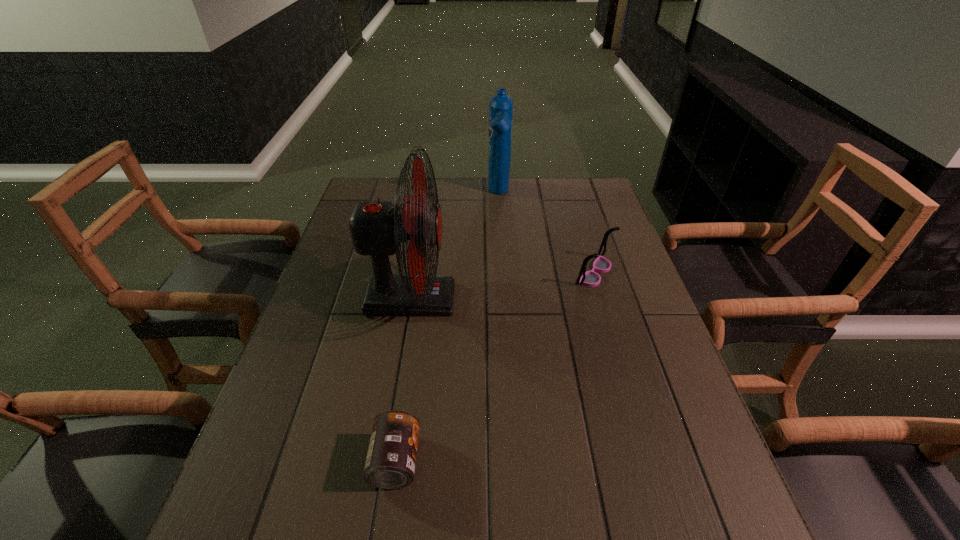
I want to click on vacant space situated 0.330m on the front label of the shortest object, so click(591, 461).

At what (x,y) coordinates should I click in order to perform the action: click on object that is positioned at the far edge. Please return your answer as a coordinate pair (x, y). This screenshot has width=960, height=540. Looking at the image, I should click on (500, 105).

Find the location of a particular element. The image size is (960, 540). object present at the left edge is located at coordinates (377, 228).

Where is `object at the right edge`? This screenshot has width=960, height=540. object at the right edge is located at coordinates (590, 278).

Find the location of a particular element. vacant space at the far edge of the desktop is located at coordinates [530, 197].

In order to click on free point at the left edge in this screenshot , I will do `click(289, 484)`.

In the image, there is a desktop. Where is `vacant space at the right edge`? vacant space at the right edge is located at coordinates (696, 483).

Find the location of a particular element. The width and height of the screenshot is (960, 540). vacant space at the far left corner of the desktop is located at coordinates (380, 183).

At what (x,y) coordinates should I click in order to perform the action: click on vacant space at the far right corner of the desktop. Please return your answer as a coordinate pair (x, y). The width and height of the screenshot is (960, 540). Looking at the image, I should click on (580, 205).

Locate an element on the screen. The width and height of the screenshot is (960, 540). empty location between the nearest object and the second shortest object is located at coordinates (495, 367).